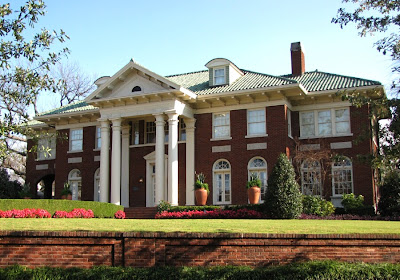
This screenshot has width=400, height=280. Identify the location of 2 flower pots. (202, 198), (254, 193).